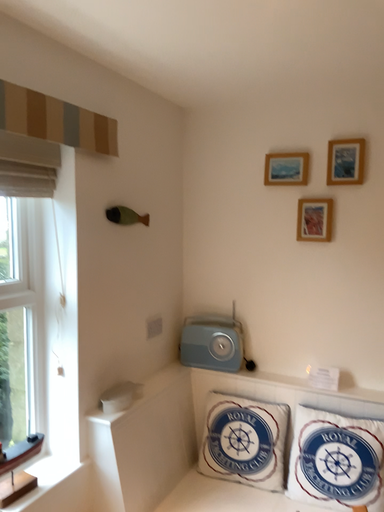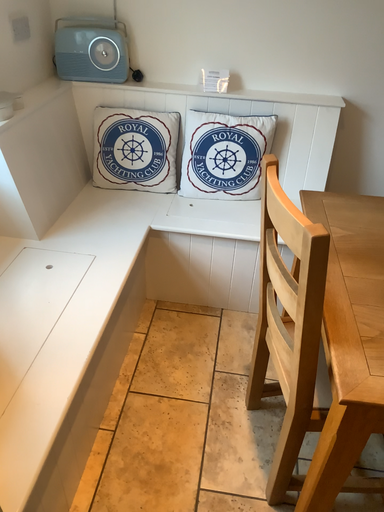
Question: Which way did the camera rotate in the video?

Choices:
 (A) rotated downward
 (B) rotated upward

Answer: (A)